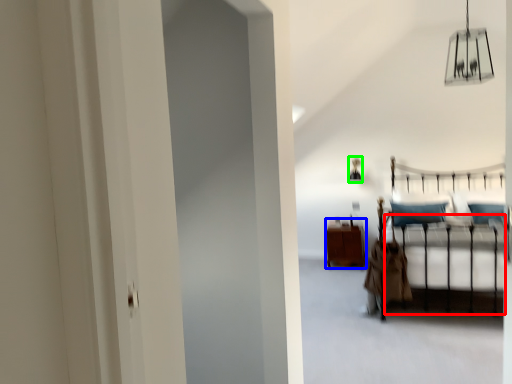
Question: Which object is positioned closest to bed frame (highlighted by a red box)? Select from furniture (highlighted by a blue box) and lamp (highlighted by a green box).

Choices:
 (A) furniture
 (B) lamp

Answer: (A)